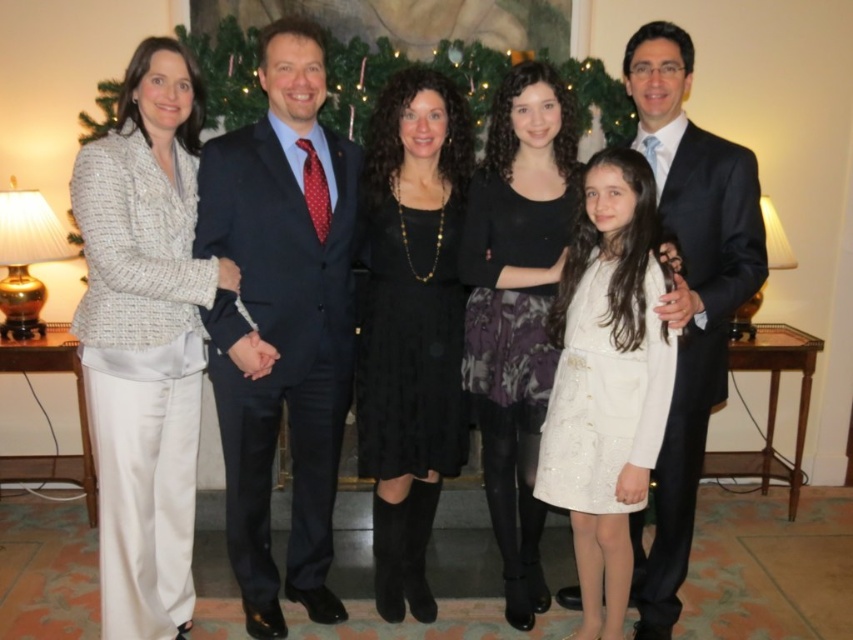
Based on the photo, you are a photographer trying to adjust the lighting for the image. The white sequined dress at center is important to highlight. Based on its position, which coordinates should you focus your spotlight on?

The white sequined dress at center is located at point (606, 381), so you should focus the spotlight on those coordinates to highlight it.

You are a photographer adjusting the camera settings to ensure all subjects are in focus. Given the white textured blazer at left and the white sequined dress at center, which one is taller in the image?

The white textured blazer at left is taller than the white sequined dress at center.

You are standing at the origin point of the image coordinate system. Where is the white textured blazer at left located in terms of coordinates?

The white textured blazer at left is located at coordinates point (144, 339).